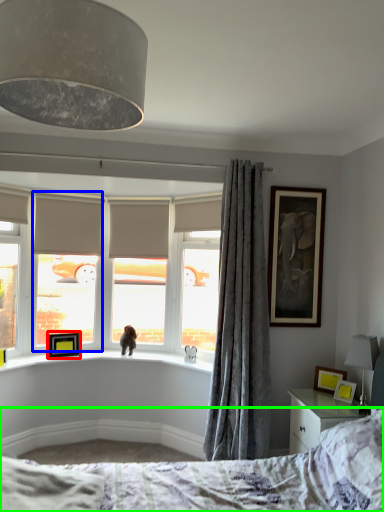
Question: Which object is positioned closest to picture frame (highlighted by a red box)? Select from window screen (highlighted by a blue box) and bed (highlighted by a green box).

Choices:
 (A) window screen
 (B) bed

Answer: (A)